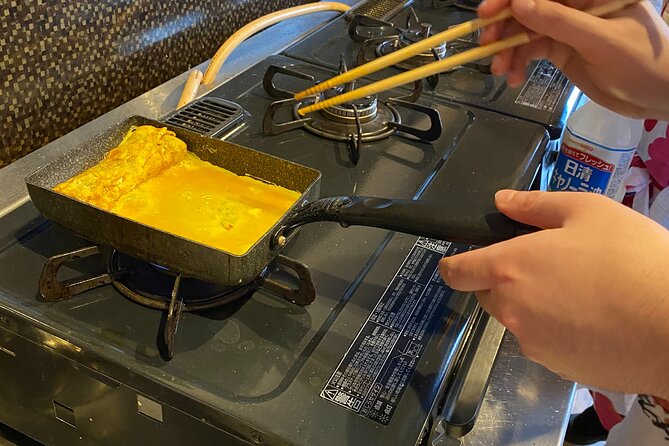
At what (x,y) coordinates should I click in order to perform the action: click on skillet. Please return your answer as a coordinate pair (x, y). The width and height of the screenshot is (669, 446). Looking at the image, I should click on (286, 168).